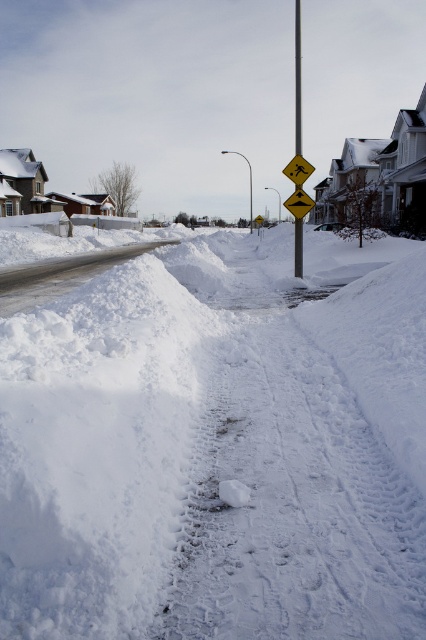
You are a delivery person trying to cross the street safely. You see a metallic pole at center and a yellow reflective diamond at center. Which object should you look towards to find the crosswalk?

The yellow reflective diamond at center indicates the crosswalk, so you should look towards it to find the crosswalk.

You are a delivery robot that needs to deliver a package to the house on the right. You see white fluffy snow at center and yellow reflective diamond at center in your path. Which object is higher and could potentially block your path?

The white fluffy snow at center is taller than the yellow reflective diamond at center, so it could potentially block the path.

You are a delivery person trying to navigate through the snow. The white fluffy snow at center and the metallic pole at center are in your path. Which one is wider so you can avoid it properly?

The metallic pole at center is wider than the white fluffy snow at center, so you should avoid the metallic pole at center properly.